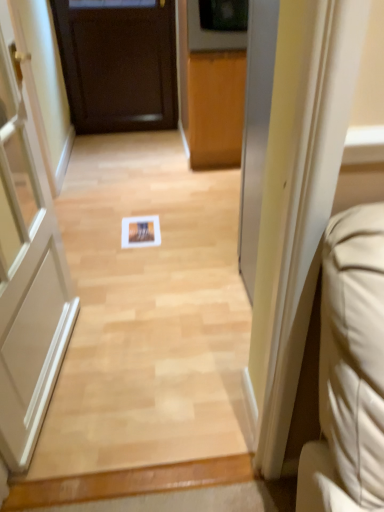
Where is `vacant area on the back side of white matte door at left, the 2th door viewed from the back`? vacant area on the back side of white matte door at left, the 2th door viewed from the back is located at coordinates (122, 297).